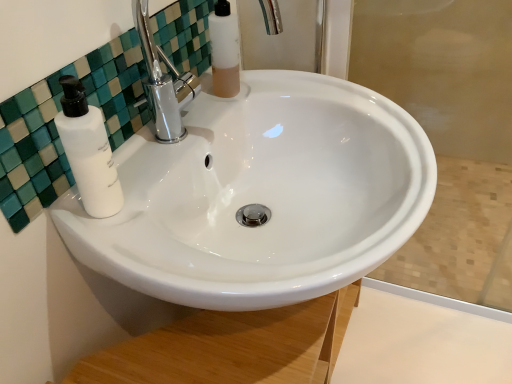
Question: Can you see white glossy sink at center touching white matte soap dispenser at left?

Choices:
 (A) yes
 (B) no

Answer: (B)

Question: Is the depth of white glossy sink at center less than that of white matte soap dispenser at left?

Choices:
 (A) no
 (B) yes

Answer: (B)

Question: Is white glossy sink at center smaller than white matte soap dispenser at left?

Choices:
 (A) yes
 (B) no

Answer: (B)

Question: Is white glossy sink at center looking in the opposite direction of white matte soap dispenser at left?

Choices:
 (A) no
 (B) yes

Answer: (A)

Question: Is white glossy sink at center positioned behind white matte soap dispenser at left?

Choices:
 (A) no
 (B) yes

Answer: (A)

Question: From the image's perspective, is white matte soap dispenser at left positioned above or below white glossy sink at center?

Choices:
 (A) below
 (B) above

Answer: (B)

Question: Is white matte soap dispenser at left situated inside white glossy sink at center or outside?

Choices:
 (A) outside
 (B) inside

Answer: (A)

Question: Considering the positions of white matte soap dispenser at left and white glossy sink at center in the image, is white matte soap dispenser at left wider or thinner than white glossy sink at center?

Choices:
 (A) wide
 (B) thin

Answer: (B)

Question: Is white matte soap dispenser at left to the left or to the right of white glossy sink at center in the image?

Choices:
 (A) right
 (B) left

Answer: (B)

Question: From the image's perspective, is white glossy sink at center positioned above or below white glossy sink at upper center?

Choices:
 (A) above
 (B) below

Answer: (B)

Question: Which is correct: white glossy sink at center is inside white glossy sink at upper center, or outside of it?

Choices:
 (A) inside
 (B) outside

Answer: (B)

Question: Considering the relative positions of white glossy sink at center and white glossy sink at upper center in the image provided, is white glossy sink at center to the left or to the right of white glossy sink at upper center?

Choices:
 (A) right
 (B) left

Answer: (A)

Question: From a real-world perspective, relative to white glossy sink at upper center, is white glossy sink at center vertically above or below?

Choices:
 (A) above
 (B) below

Answer: (B)

Question: Considering the positions of translucent plastic mouthwash at upper center and white glossy sink at center in the image, is translucent plastic mouthwash at upper center bigger or smaller than white glossy sink at center?

Choices:
 (A) big
 (B) small

Answer: (B)

Question: From a real-world perspective, is translucent plastic mouthwash at upper center positioned above or below white glossy sink at center?

Choices:
 (A) below
 (B) above

Answer: (B)